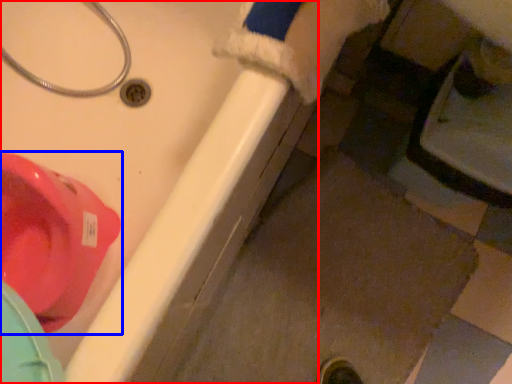
Question: Which object appears closest to the camera in this image, bath (highlighted by a red box) or toilet (highlighted by a blue box)?

Choices:
 (A) bath
 (B) toilet

Answer: (A)